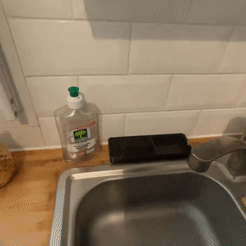
Where is `counter top left of sink`? Image resolution: width=246 pixels, height=246 pixels. counter top left of sink is located at coordinates (16, 230).